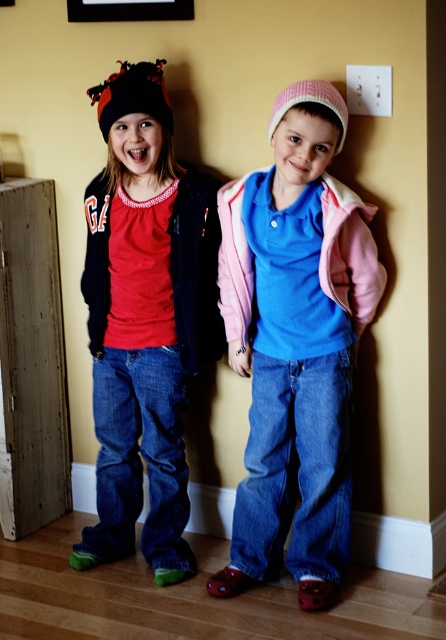
Based on the photo, you are an interior designer working on a layout for a children room. You need to place a new shelf at position point 0.5, 0.6. Considering the pink fleece jacket at center, which is located at point 0.539, 0.664, will the shelf interfere with the jacket?

The pink fleece jacket at center is located at point (296, 344), which is close to the desired shelf position at (267, 320). Depending on the size of the shelf, there might be interference. However, since the coordinates are slightly offset, it might fit without overlapping if the shelf dimensions are appropriate.

You are a photographer trying to capture a photo of both children. You notice two points in the image at coordinates point (x=313, y=419) and point (x=124, y=440). Which point is closer to the camera?

Point (x=313, y=419) is closer to the viewer than point (x=124, y=440).

You are a photographer standing 10 feet away from the matte black beanie at left. Can you take a clear photo of it without moving closer?

The matte black beanie at left is 8.22 feet away from the camera. Since you are standing 10 feet away, it is 1.78 feet further away than the camera, so you might need to move closer for a clearer photo.